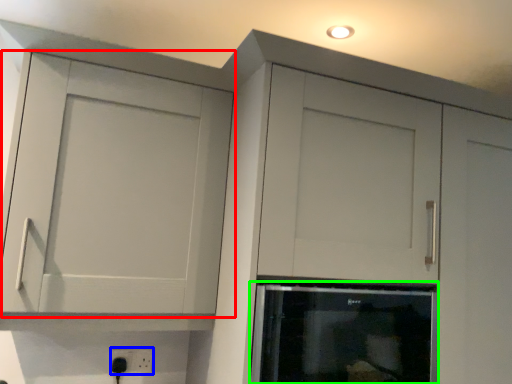
Question: Based on their relative distances, which object is farther from cupboard (highlighted by a red box)? Choose from electric outlet (highlighted by a blue box) and appliance (highlighted by a green box).

Choices:
 (A) electric outlet
 (B) appliance

Answer: (A)